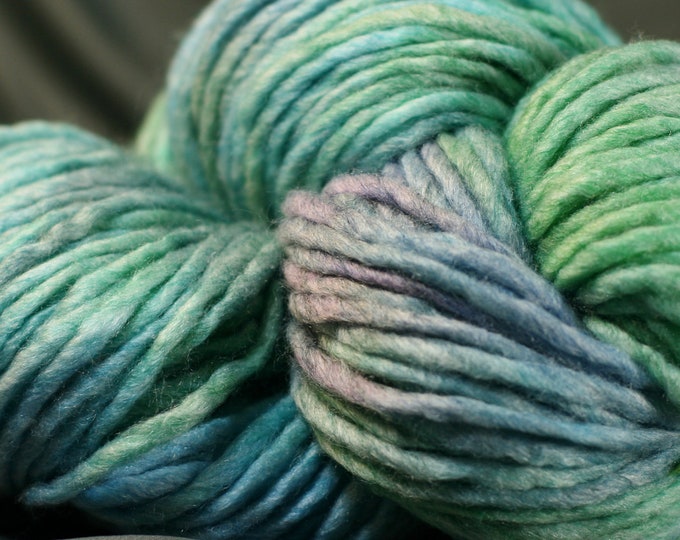
This screenshot has height=540, width=680. I want to click on multi-colored yarn, so click(407, 221).